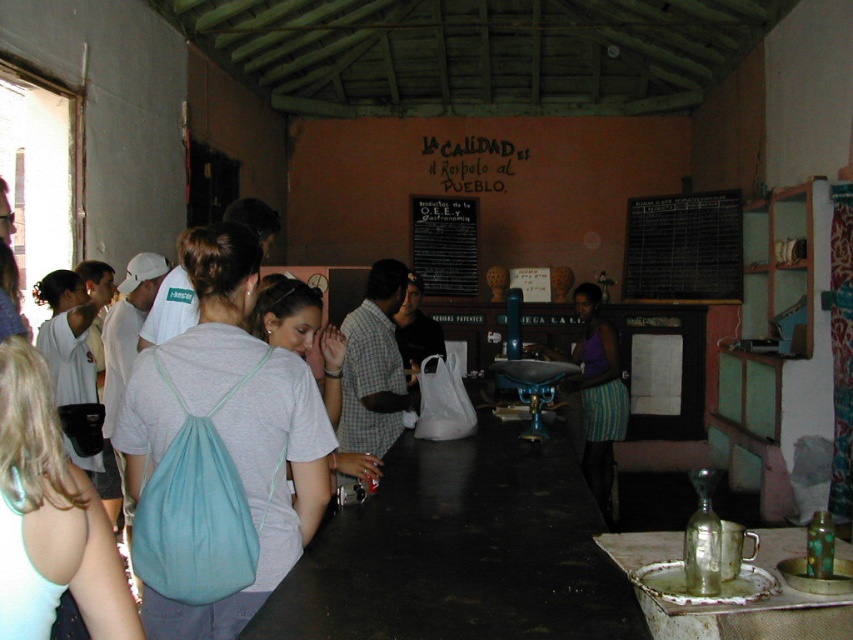
You are a customer at the rustic cafe and you want to place your teal fabric backpack at center on the black matte table at center. Will the backpack fit on the table?

The teal fabric backpack at center is much taller than the black matte table at center, so it will not fit on the table.

You are standing at the entrance of the cafe and want to reach both the white fabric backpack at center and the purple fabric skirt at center. Which object is farther away from you?

The white fabric backpack at center is 4.27 meters away from the purple fabric skirt at center. Since you are at the entrance, it depends on their positions relative to you. However, without knowing your exact starting point, we can only state the distance between them. Please clarify your position for a more accurate answer.

You are standing at the entrance of the rustic cafe and want to take a photo of the point at coordinates (x=235, y=349). The camera you are using has a maximum focus range of 6 feet. Will the camera be able to focus on the point?

The point at coordinates (x=235, y=349) is 6.48 feet away from the camera, which exceeds the camera maximum focus range of 6 feet. Therefore, the camera will not be able to focus on the point.